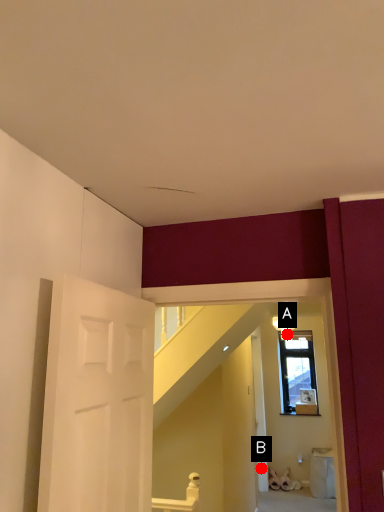
Question: Two points are circled on the image, labeled by A and B beside each circle. Which point is further to the camera?

Choices:
 (A) A is further
 (B) B is further

Answer: (A)